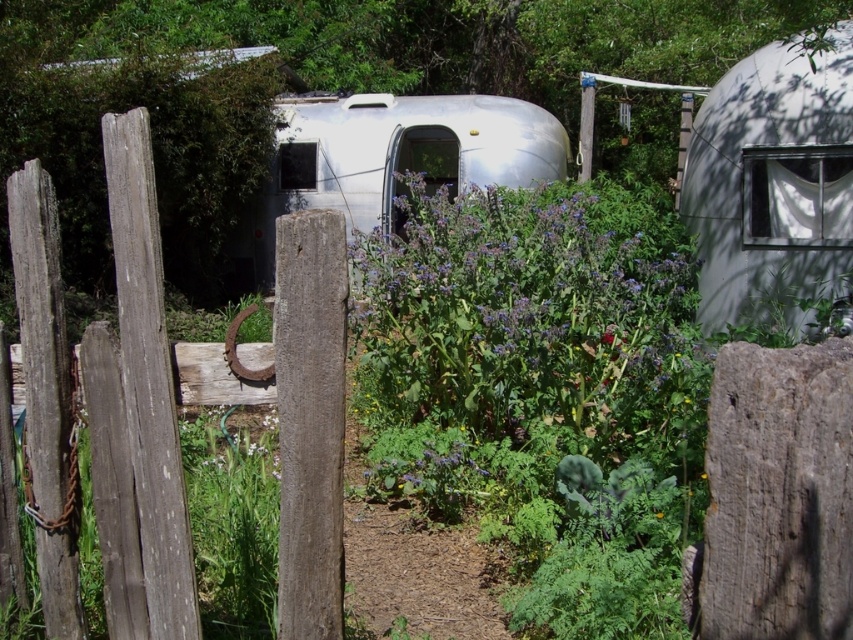
You are standing in the garden and want to take a photo of the silver metallic trailer at center. However, the weathered wood fence at left is blocking your view. Can you step back to get the entire trailer in the frame without any obstruction?

The weathered wood fence at left is closer to the viewer than the silver metallic trailer at center. By stepping back, you can create enough distance to ensure the trailer is fully visible while the fence moves out of the way, allowing an unobstructed view of the silver metallic trailer at center.

You are standing in the garden area and want to walk from the weathered wooden fence to the Airstream trailer. You notice two points marked in the scene, point 1 at coordinates point (296, 604) and point 2 at coordinates point (276, 179). Which point is closer to you as you stand at the fence?

Point (296, 604) is closer to the viewer than point (276, 179), so the point closer to you is point (296, 604).